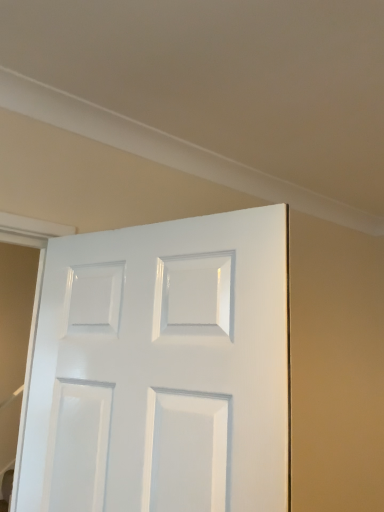
Describe the element at coordinates (162, 369) in the screenshot. I see `white glossy door at center` at that location.

Where is `white glossy door at center`? white glossy door at center is located at coordinates tap(162, 369).

You are a GUI agent. You are given a task and a screenshot of the screen. Output one action in this format:
    pyautogui.click(x=<x>, y=<y>)
    Task: Click on the white glossy door at center
    The height and width of the screenshot is (512, 384).
    Given the screenshot: What is the action you would take?
    pyautogui.click(x=162, y=369)